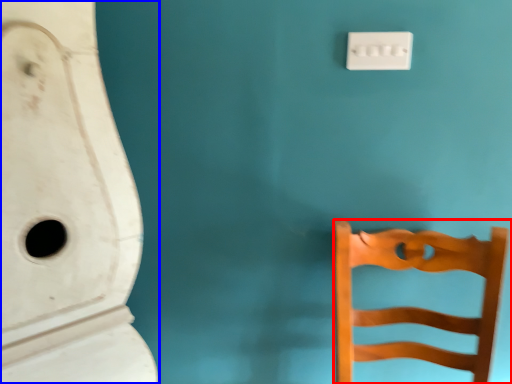
Question: Which object is further to the camera taking this photo, furniture (highlighted by a red box) or urinal (highlighted by a blue box)?

Choices:
 (A) furniture
 (B) urinal

Answer: (A)